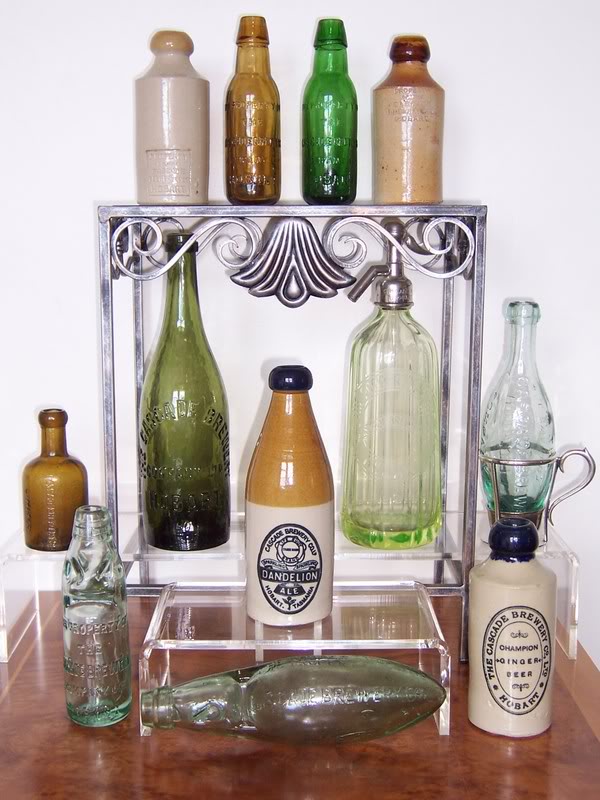
Find the location of a particular element. The width and height of the screenshot is (600, 800). shiny wooden surface is located at coordinates (53, 766).